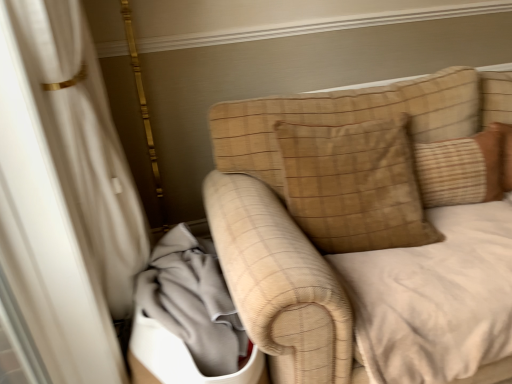
Question: Based on their sizes in the image, would you say gray fabric at lower left is bigger or smaller than brown textured pillow at upper right, acting as the 1th pillow starting from the right?

Choices:
 (A) big
 (B) small

Answer: (A)

Question: Is point (239, 329) closer or farther from the camera than point (435, 175)?

Choices:
 (A) farther
 (B) closer

Answer: (B)

Question: Which is nearer to the brown suede pillow at upper right, the second pillow viewed from the right?

Choices:
 (A) gray fabric at lower left
 (B) brown textured pillow at upper right, acting as the 1th pillow starting from the right

Answer: (B)

Question: Which object is the closest to the brown textured pillow at upper right, which appears as the second pillow when viewed from the left?

Choices:
 (A) gray fabric at lower left
 (B) brown suede pillow at upper right, the first pillow from the left

Answer: (B)